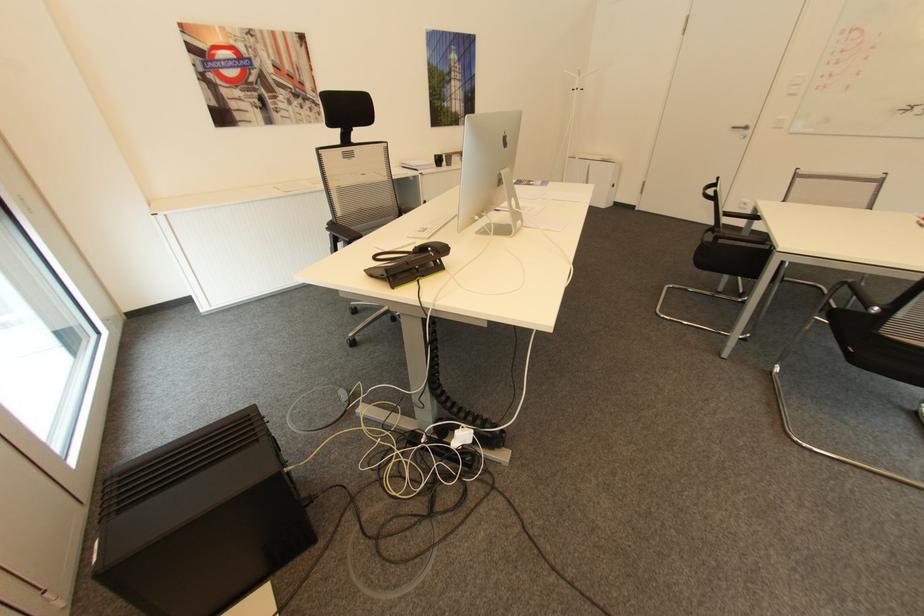
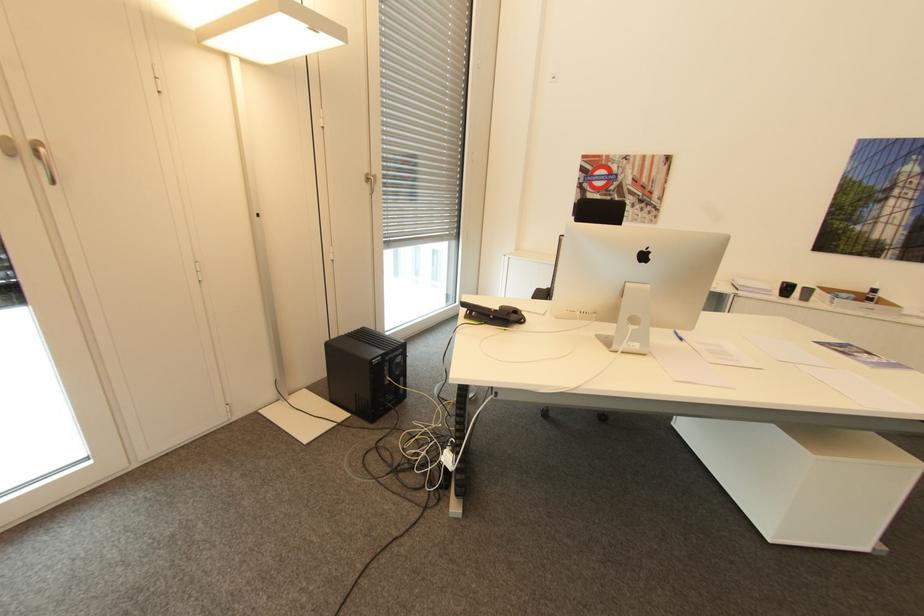
The point at (441, 155) is marked in the first image. Where is the corresponding point in the second image?

(788, 283)